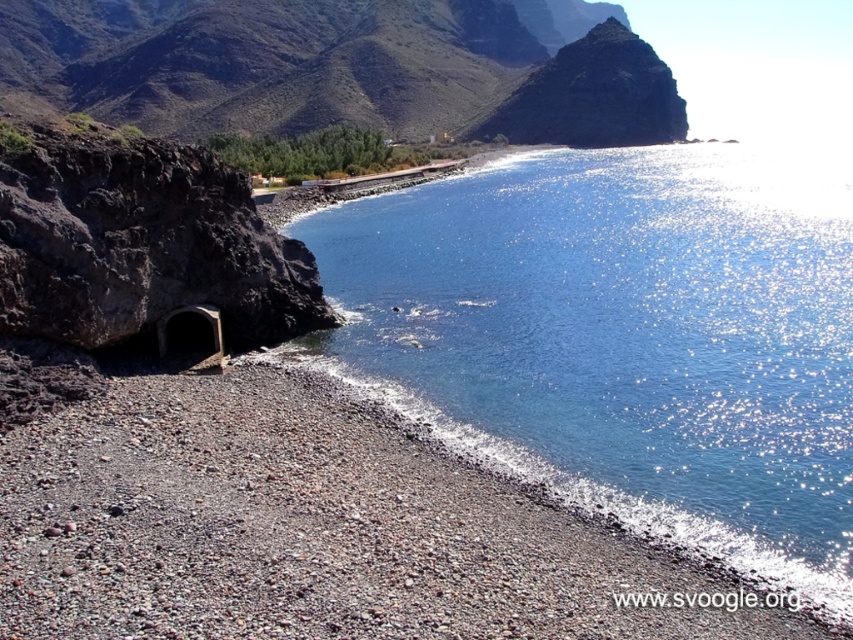
Question: Which point is closer to the camera taking this photo?

Choices:
 (A) (589, 212)
 (B) (346, 104)
 (C) (323, 630)

Answer: (C)

Question: From the image, what is the correct spatial relationship of blue glassy water at center in relation to rugged rock mountain at upper left?

Choices:
 (A) left
 (B) right

Answer: (B)

Question: Observing the image, what is the correct spatial positioning of blue glassy water at center in reference to smooth pebbles at lower left?

Choices:
 (A) below
 (B) above

Answer: (B)

Question: Which point is farther to the camera?

Choices:
 (A) smooth pebbles at lower left
 (B) rugged rock mountain at upper left

Answer: (B)

Question: Which point appears farthest from the camera in this image?

Choices:
 (A) (726, 420)
 (B) (318, 99)
 (C) (563, 605)

Answer: (B)

Question: In this image, where is smooth pebbles at lower left located relative to rugged rock mountain at upper left?

Choices:
 (A) left
 (B) right

Answer: (B)